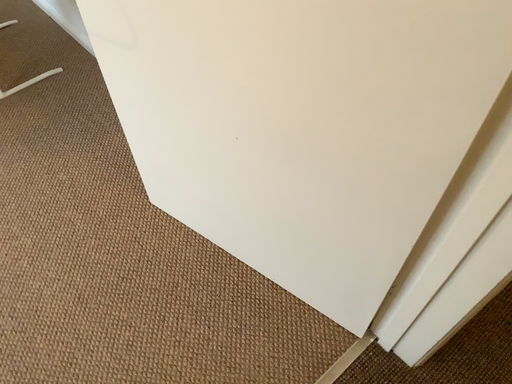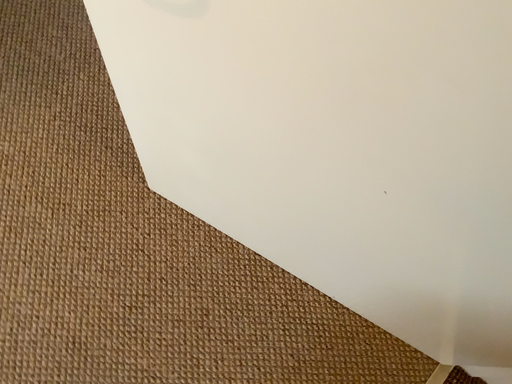
Question: Which way did the camera rotate in the video?

Choices:
 (A) rotated right
 (B) rotated left

Answer: (A)